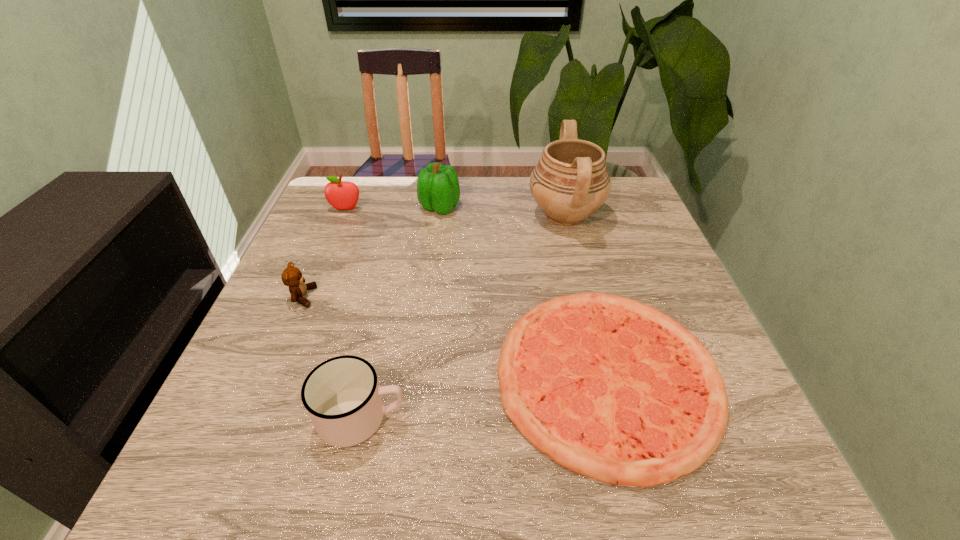
Where is `vacant area that lies between the bell pepper and the urn`? This screenshot has height=540, width=960. vacant area that lies between the bell pepper and the urn is located at coordinates (502, 211).

Where is `vacant area that lies between the urn and the teddy bear`? vacant area that lies between the urn and the teddy bear is located at coordinates (434, 256).

Locate an element on the screen. free space between the teddy bear and the mug is located at coordinates (332, 357).

Identify which object is located as the fourth nearest to the urn. Please provide its 2D coordinates. Your answer should be formatted as a tuple, i.e. [(x, y)], where the tuple contains the x and y coordinates of a point satisfying the conditions above.

[(343, 399)]

Identify which object is the fifth nearest to the teddy bear. Please provide its 2D coordinates. Your answer should be formatted as a tuple, i.e. [(x, y)], where the tuple contains the x and y coordinates of a point satisfying the conditions above.

[(570, 182)]

In order to click on vacant space that satisfies the following two spatial constraints: 1. on the front-facing side of the tallest object; 2. on the left side of the shortest object in this screenshot , I will do tap(606, 376).

This screenshot has width=960, height=540. Find the location of `free space that satisfies the following two spatial constraints: 1. on the front side of the pizza; 2. on the side of the mug with the handle`. free space that satisfies the following two spatial constraints: 1. on the front side of the pizza; 2. on the side of the mug with the handle is located at coordinates (617, 417).

Where is `vacant space that satisfies the following two spatial constraints: 1. on the front side of the pizza; 2. on the right side of the apple`? The height and width of the screenshot is (540, 960). vacant space that satisfies the following two spatial constraints: 1. on the front side of the pizza; 2. on the right side of the apple is located at coordinates (278, 376).